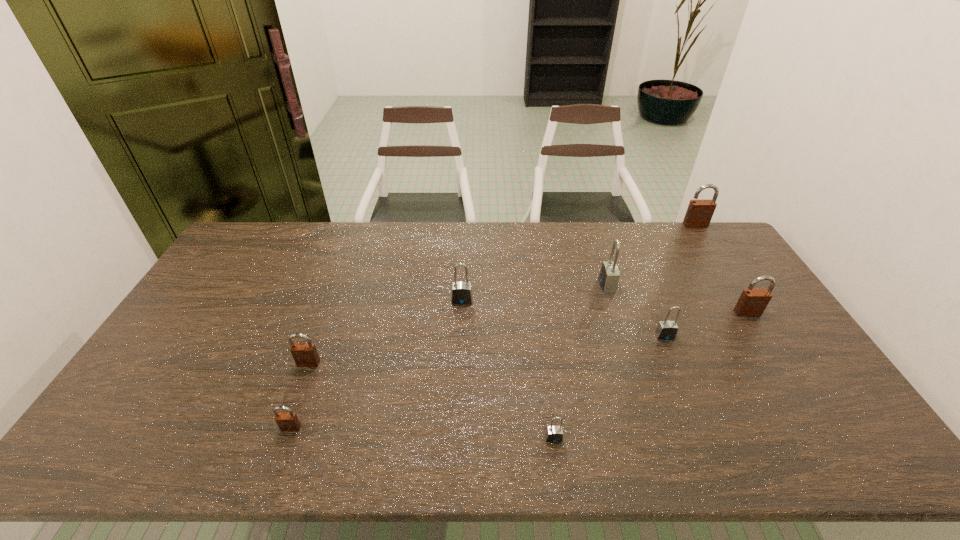
At what (x,y) coordinates should I click in order to perform the action: click on the farthest object. Please return your answer as a coordinate pair (x, y). This screenshot has width=960, height=540. Looking at the image, I should click on (699, 213).

Where is `the biggest brown padlock`? The width and height of the screenshot is (960, 540). the biggest brown padlock is located at coordinates (699, 213).

Locate an element on the screen. The width and height of the screenshot is (960, 540). the second gray padlock from right to left is located at coordinates (609, 275).

Where is `the biggest gray padlock`? This screenshot has width=960, height=540. the biggest gray padlock is located at coordinates (609, 275).

You are a GUI agent. You are given a task and a screenshot of the screen. Output one action in this format:
    pyautogui.click(x=<x>, y=<y>)
    Task: Click on the second biggest gray padlock
    The width and height of the screenshot is (960, 540).
    Given the screenshot: What is the action you would take?
    pyautogui.click(x=461, y=291)

This screenshot has width=960, height=540. I want to click on the third farthest padlock, so click(461, 291).

The image size is (960, 540). I want to click on the second biggest brown padlock, so click(x=752, y=302).

You are a GUI agent. You are given a task and a screenshot of the screen. Output one action in this format:
    pyautogui.click(x=<x>, y=<y>)
    Task: Click on the third nearest brown padlock
    
    Given the screenshot: What is the action you would take?
    pyautogui.click(x=752, y=302)

Where is `the fifth farthest padlock`? the fifth farthest padlock is located at coordinates (666, 330).

Identify the location of the third object from right to left. The height and width of the screenshot is (540, 960). (666, 330).